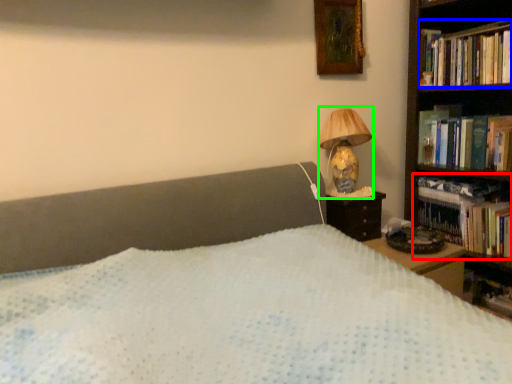
Question: Estimate the real-world distances between objects in this image. Which object is farther from book (highlighted by a red box), book (highlighted by a blue box) or lamp (highlighted by a green box)?

Choices:
 (A) book
 (B) lamp

Answer: (A)